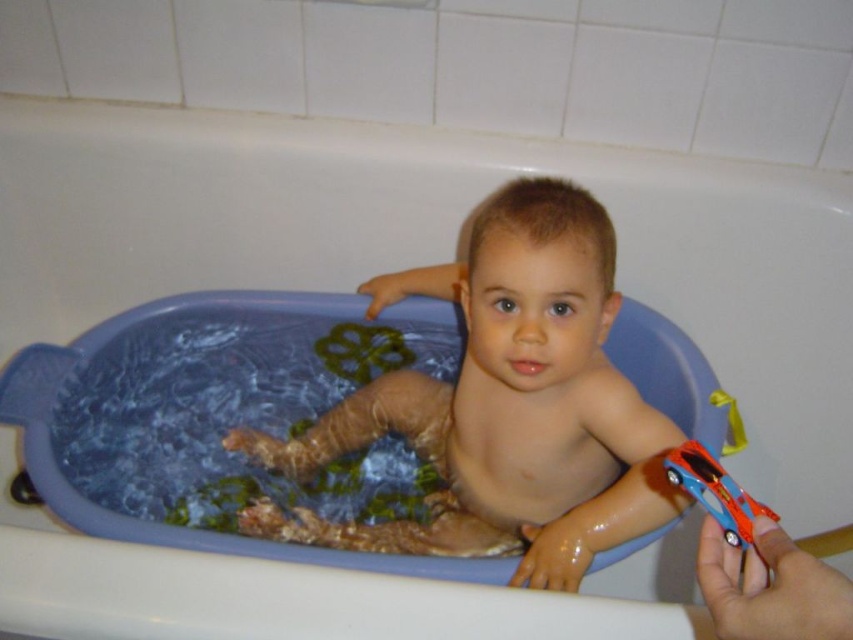
Does point (654, 522) come closer to viewer compared to point (699, 468)?

That is False.

What do you see at coordinates (505, 404) in the screenshot? I see `smooth skin child at center` at bounding box center [505, 404].

This screenshot has width=853, height=640. I want to click on smooth skin child at center, so click(505, 404).